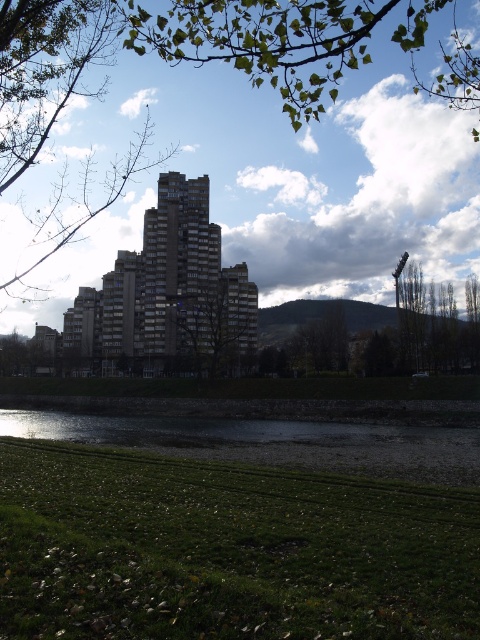
Question: Which of the following is the closest to the observer?

Choices:
 (A) green grassy bank at lower center
 (B) green leafy tree at right
 (C) green grass at lower center
 (D) green leafy tree at center

Answer: (C)

Question: Where is green grassy bank at lower center located in relation to green leafy tree at right in the image?

Choices:
 (A) right
 (B) left

Answer: (B)

Question: Which object appears farthest from the camera in this image?

Choices:
 (A) green grass at lower center
 (B) green grassy bank at lower center
 (C) green leafy tree at right

Answer: (C)

Question: Is green grassy bank at lower center above green leafy tree at center?

Choices:
 (A) yes
 (B) no

Answer: (B)

Question: Which point is closer to the camera?

Choices:
 (A) green leafy tree at right
 (B) green grass at lower center
 (C) green grassy bank at lower center

Answer: (B)

Question: Can you confirm if green grass at lower center is thinner than green leafy tree at center?

Choices:
 (A) no
 (B) yes

Answer: (B)